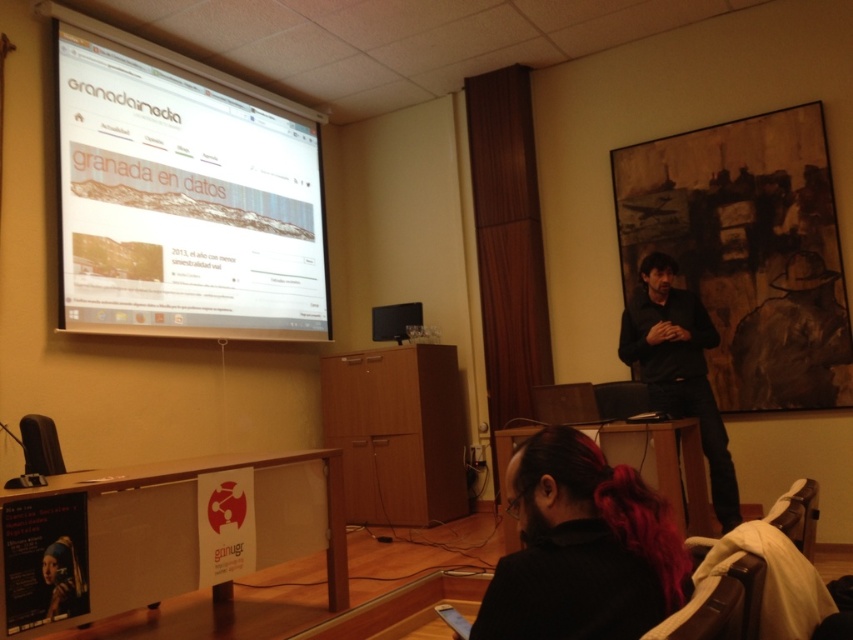
You are sitting in the conference room and want to look at the white glossy projector screen at upper left and the black matte shirt at center. Which one is located to the left side of the other?

The white glossy projector screen at upper left is to the left of the black matte shirt at center.

You are standing in the conference room and want to place a small plant on the floor at point (105, 291). The plant requires a minimum of 4 meters of space from the nearest obstruction. Is this location suitable?

The distance of point (105, 291) from viewer is 3.81 meters, which is less than the required 4 meters. Therefore, the location is not suitable for placing the plant.

You are sitting at the back of the conference room and want to see the presenter with dark hair at lower center. Is the white glossy projector screen at upper left blocking your view of them?

The dark hair at lower center is behind the white glossy projector screen at upper left, so the screen is blocking your view of the presenter.